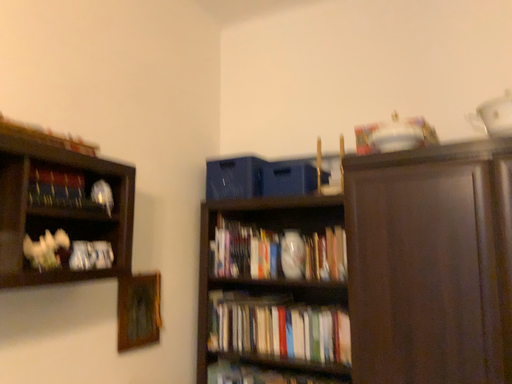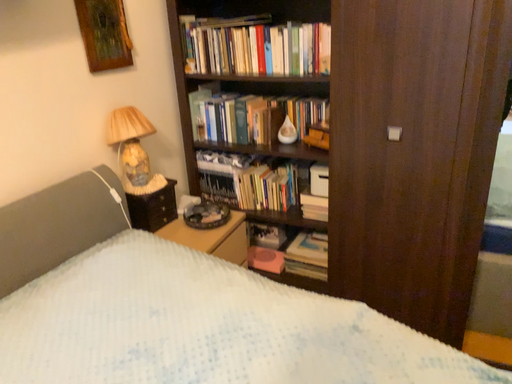
Question: Which way did the camera rotate in the video?

Choices:
 (A) rotated upward
 (B) rotated downward

Answer: (B)